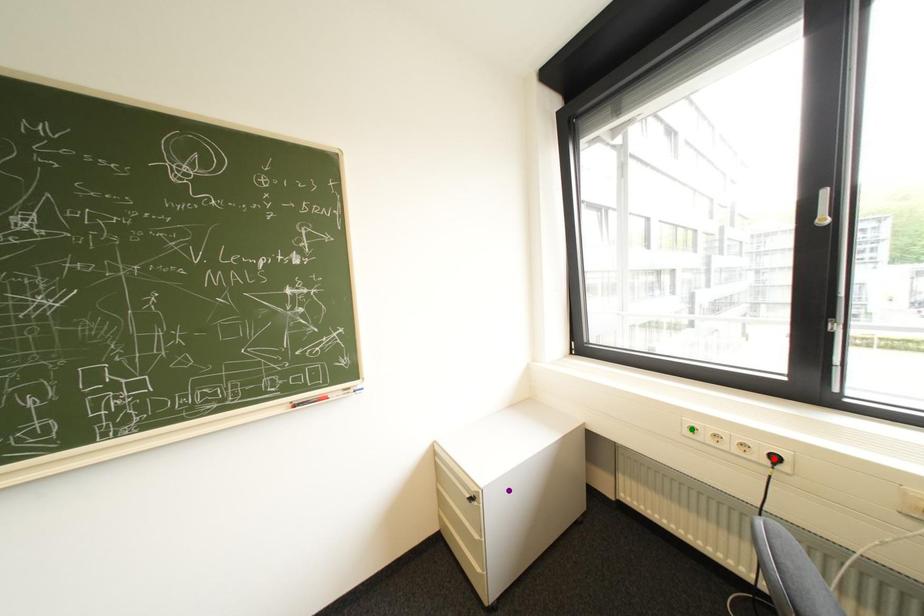
Order these from nearest to farthest:
A) red point
B) purple point
C) green point

red point
purple point
green point